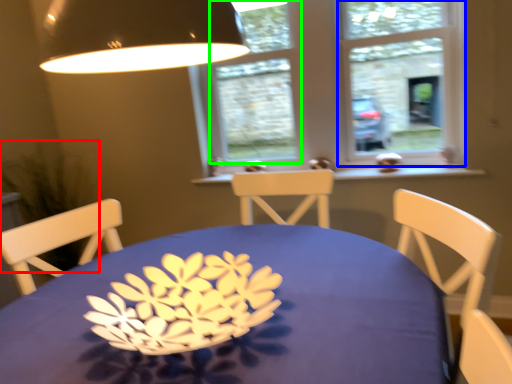
Question: Considering the real-world distances, which object is farthest from plant (highlighted by a red box)? window frame (highlighted by a blue box) or window (highlighted by a green box)?

Choices:
 (A) window frame
 (B) window

Answer: (A)